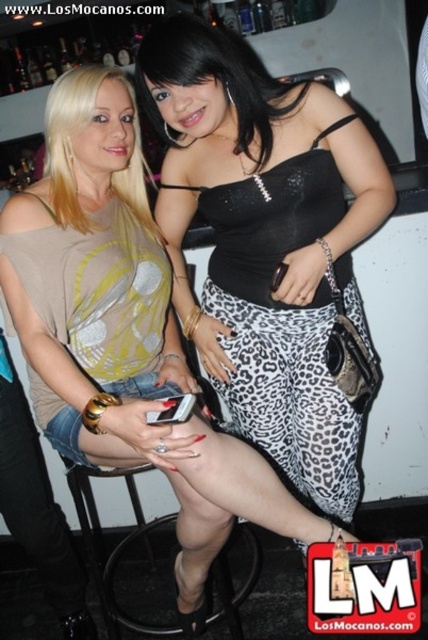
Can you confirm if black leopard print pants at center is thinner than black plastic bar stool at lower center?

Yes.

Is black leopard print pants at center to the right of black plastic bar stool at lower center from the viewer's perspective?

Correct, you'll find black leopard print pants at center to the right of black plastic bar stool at lower center.

Is point (241, 362) farther from viewer compared to point (229, 605)?

No, it is not.

Where is `black leopard print pants at center`? The width and height of the screenshot is (428, 640). black leopard print pants at center is located at coordinates (282, 323).